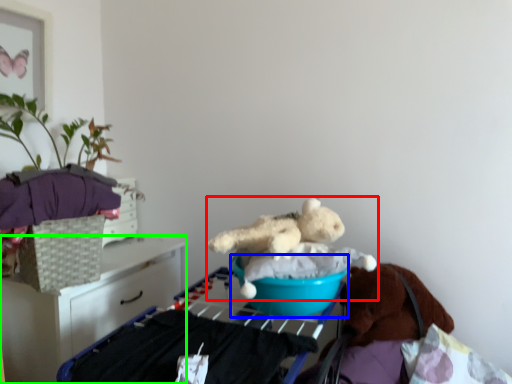
Question: Estimate the real-world distances between objects in this image. Which object is farther from teddy bear (highlighted by a red box), basin (highlighted by a blue box) or furniture (highlighted by a green box)?

Choices:
 (A) basin
 (B) furniture

Answer: (B)